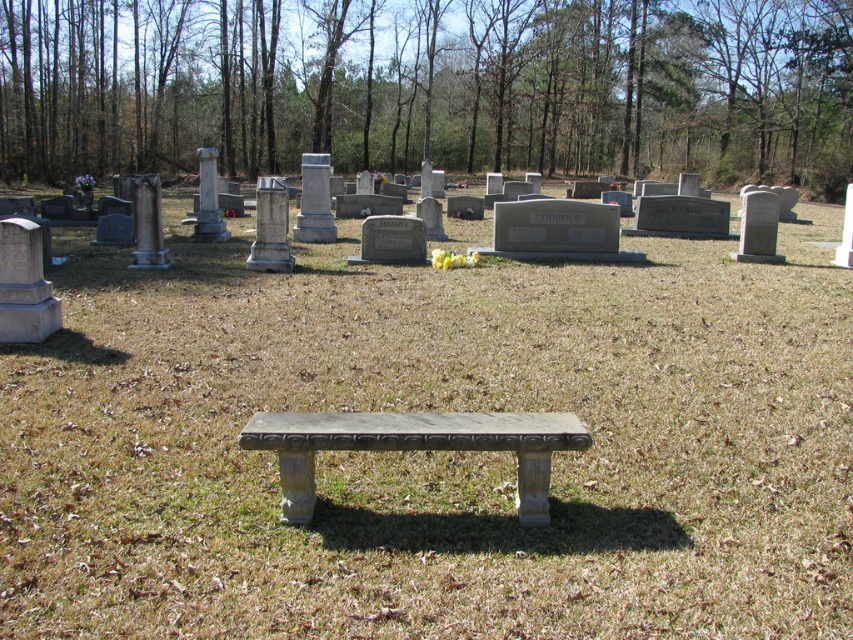
Question: Does green grass at center appear on the left side of gray stone bench at center?

Choices:
 (A) no
 (B) yes

Answer: (B)

Question: Which object is positioned farthest from the green leafy tree at upper center?

Choices:
 (A) green grass at center
 (B) gray stone bench at center

Answer: (B)

Question: Estimate the real-world distances between objects in this image. Which object is farther from the gray stone bench at center?

Choices:
 (A) green grass at center
 (B) green leafy tree at upper center

Answer: (B)

Question: Which of the following is the closest to the observer?

Choices:
 (A) [x=653, y=19]
 (B) [x=444, y=419]

Answer: (B)

Question: Is green grass at center closer to camera compared to green leafy tree at upper center?

Choices:
 (A) no
 (B) yes

Answer: (B)

Question: Does green leafy tree at upper center have a smaller size compared to gray stone bench at center?

Choices:
 (A) yes
 (B) no

Answer: (B)